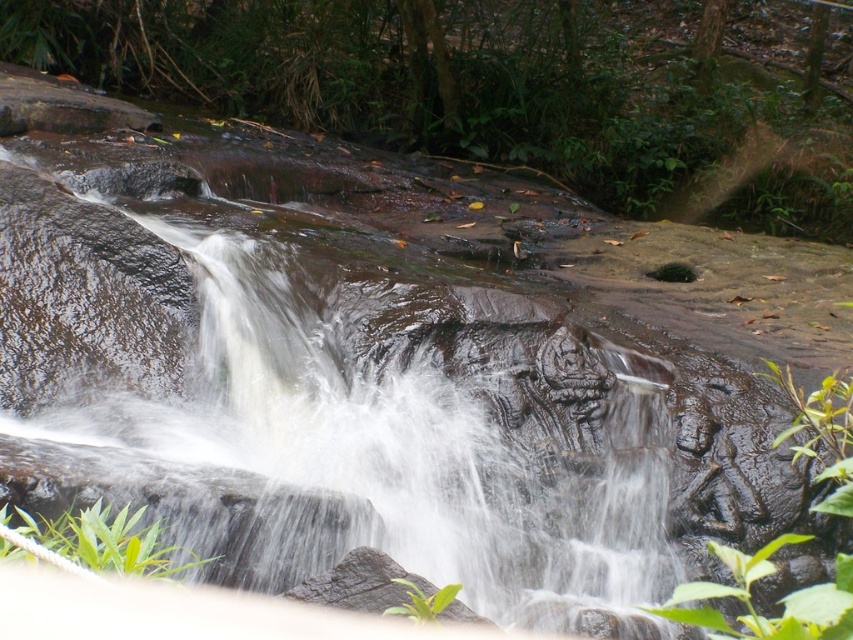
Which is in front, point (128, 77) or point (38, 524)?

Point (38, 524)

Does green leafy vegetation at center have a smaller size compared to green leafy plant at lower left?

No.

Locate an element on the screen. green leafy vegetation at center is located at coordinates (492, 83).

Does smooth brown rock at center appear on the left side of green leafy plant at lower left?

Incorrect, smooth brown rock at center is not on the left side of green leafy plant at lower left.

The image size is (853, 640). Describe the element at coordinates (318, 410) in the screenshot. I see `smooth brown rock at center` at that location.

I want to click on smooth brown rock at center, so click(318, 410).

Does green leafy vegetation at center have a larger size compared to green matte rock at center?

Yes, green leafy vegetation at center is bigger than green matte rock at center.

Does point (403, 10) come closer to viewer compared to point (833, 416)?

No, (403, 10) is behind (833, 416).

At what (x,y) coordinates should I click in order to perform the action: click on green leafy vegetation at center. Please return your answer as a coordinate pair (x, y). This screenshot has width=853, height=640. Looking at the image, I should click on (492, 83).